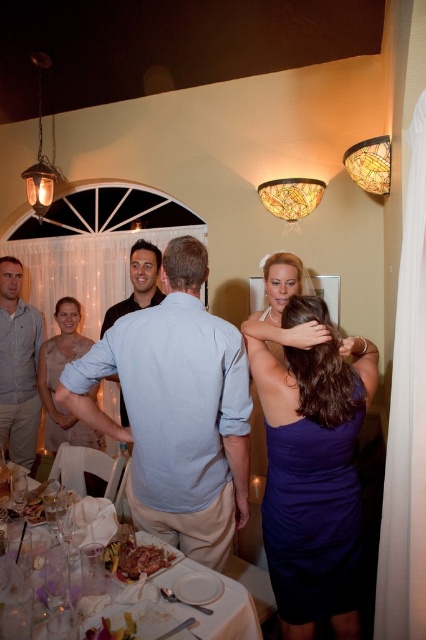
You are a photographer at the wedding reception. You need to capture a photo that includes both the purple satin dress at upper right and the matte black shirt at center. Based on their positions, where should you position yourself to ensure both are in the frame?

Since the purple satin dress at upper right is located below the matte black shirt at center, you should position yourself slightly above and to the right of the matte black shirt at center to include both in the frame.

You are standing at the entrance of the reception and want to greet both the person in the matte beige dress at center and the person in the matte black shirt at center. Which one should you approach first based on their positions?

You should approach the matte beige dress at center first because it is closer to you than the matte black shirt at center, which is further away.

You are a photographer at the wedding reception. You want to take a photo of both the purple satin dress at upper right and the matte beige dress at center. However, you can only position yourself in a spot where you can see both dresses clearly. Based on their positions, is there a vantage point where you can capture both dresses in the same frame without obstruction?

Yes, since the purple satin dress at upper right is in front of the matte beige dress at center, you can position yourself behind the matte beige dress at center so that the purple satin dress at upper right is visible in front of it, allowing both to be in the frame without obstruction.